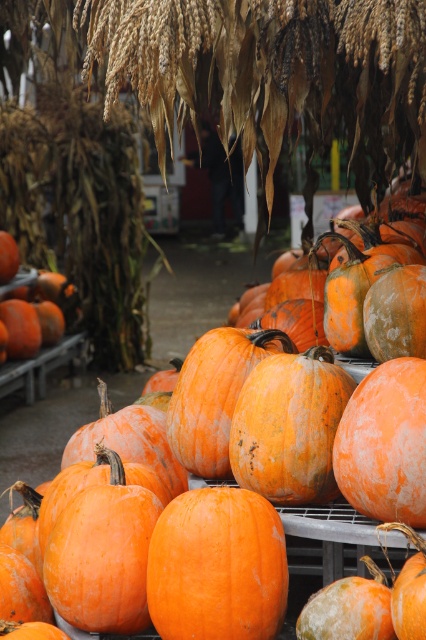
Consider the image. Who is more distant from viewer, (210, 252) or (204, 560)?

Point (210, 252)

Between orange matte pumpkin at center and orange rough pumpkin at center, which one has more height?

orange rough pumpkin at center is taller.

Is point (216, 262) positioned after point (227, 624)?

That is True.

The image size is (426, 640). I want to click on orange matte pumpkin at center, so click(138, 364).